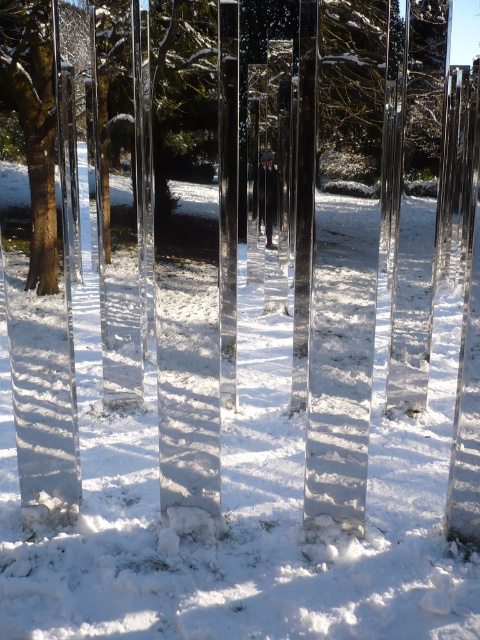
Can you confirm if white glossy snow at center is smaller than brown wood tree at left?

Yes.

Looking at this image, who is taller, white glossy snow at center or brown wood tree at left?

brown wood tree at left

Identify the location of white glossy snow at center. Image resolution: width=480 pixels, height=640 pixels. (240, 508).

You are a GUI agent. You are given a task and a screenshot of the screen. Output one action in this format:
    pyautogui.click(x=<x>, y=<y>)
    Task: Click on the white glossy snow at center
    Image resolution: width=480 pixels, height=640 pixels.
    Given the screenshot: What is the action you would take?
    pyautogui.click(x=240, y=508)